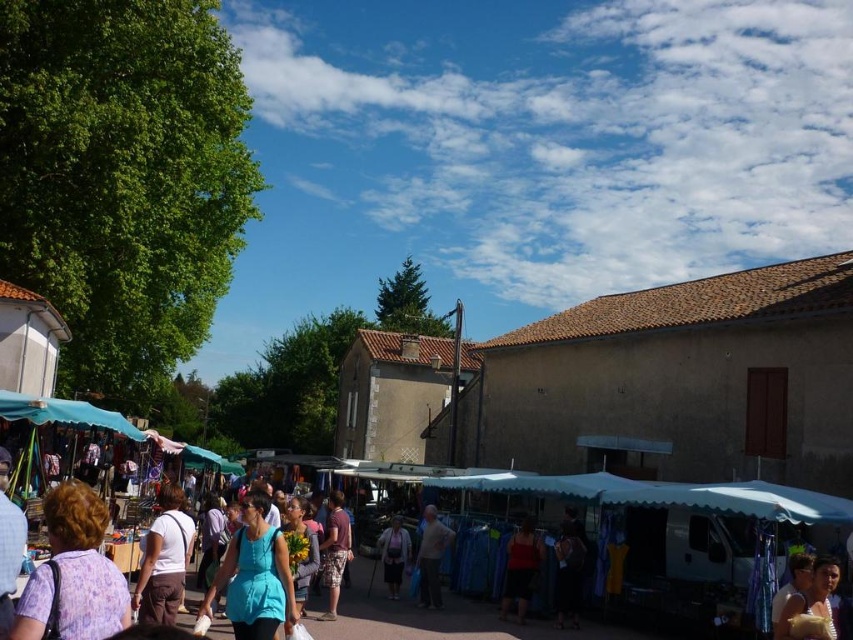
Is matte red tank top at center closer to the viewer compared to camouflage shorts at center?

No, matte red tank top at center is further to the viewer.

The width and height of the screenshot is (853, 640). Identify the location of matte red tank top at center. (521, 568).

Locate an element on the screen. matte red tank top at center is located at coordinates (521, 568).

Can you confirm if matte blue shirt at center is thinner than camouflage shorts at center?

No.

I want to click on matte blue shirt at center, so click(253, 576).

You are a GUI agent. You are given a task and a screenshot of the screen. Output one action in this format:
    pyautogui.click(x=<x>, y=<y>)
    Task: Click on the matte blue shirt at center
    The height and width of the screenshot is (640, 853).
    Given the screenshot: What is the action you would take?
    pyautogui.click(x=253, y=576)

Who is higher up, matte blue shirt at center or matte purple dress at center?

matte blue shirt at center is above.

Does point (268, 566) come farther from viewer compared to point (398, 563)?

That is False.

Locate an element on the screen. The width and height of the screenshot is (853, 640). matte blue shirt at center is located at coordinates (253, 576).